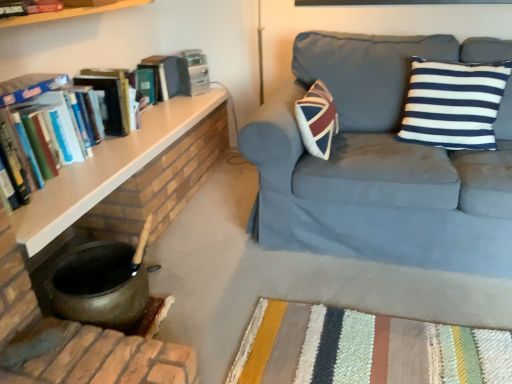
Question: Is suede blue couch at upper right facing towards hardcover books at left, which is the 1th book from bottom to top?

Choices:
 (A) yes
 (B) no

Answer: (B)

Question: Is suede blue couch at upper right positioned far away from hardcover books at left, which is the 1th book from bottom to top?

Choices:
 (A) no
 (B) yes

Answer: (B)

Question: Is suede blue couch at upper right at the right side of hardcover books at left, the 2th book positioned from the top?

Choices:
 (A) no
 (B) yes

Answer: (B)

Question: Considering the relative sizes of suede blue couch at upper right and hardcover books at left, which is the 1th book from bottom to top, in the image provided, is suede blue couch at upper right smaller than hardcover books at left, which is the 1th book from bottom to top,?

Choices:
 (A) yes
 (B) no

Answer: (B)

Question: From the image's perspective, is suede blue couch at upper right located above hardcover books at left, the 2th book positioned from the top?

Choices:
 (A) yes
 (B) no

Answer: (B)

Question: From a real-world perspective, is suede blue couch at upper right under hardcover books at left, which is the 1th book from bottom to top?

Choices:
 (A) yes
 (B) no

Answer: (A)

Question: Is hardcover books at left, the 2th book positioned from the top, at the back of hardcover book at upper left?

Choices:
 (A) no
 (B) yes

Answer: (A)

Question: Is hardcover book at upper left closer to the viewer compared to hardcover books at left, which is the 1th book from bottom to top?

Choices:
 (A) no
 (B) yes

Answer: (A)

Question: Is hardcover book at upper left positioned beyond the bounds of hardcover books at left, the 2th book positioned from the top?

Choices:
 (A) yes
 (B) no

Answer: (A)

Question: Can you confirm if hardcover book at upper left is taller than hardcover books at left, the 2th book positioned from the top?

Choices:
 (A) no
 (B) yes

Answer: (A)

Question: Is hardcover book at upper left behind hardcover books at left, the 2th book positioned from the top?

Choices:
 (A) no
 (B) yes

Answer: (B)

Question: Is hardcover book at upper left with hardcover books at left, the 2th book positioned from the top?

Choices:
 (A) yes
 (B) no

Answer: (B)

Question: Would you say hardcover book at upper left is outside suede blue couch at upper right?

Choices:
 (A) no
 (B) yes

Answer: (B)